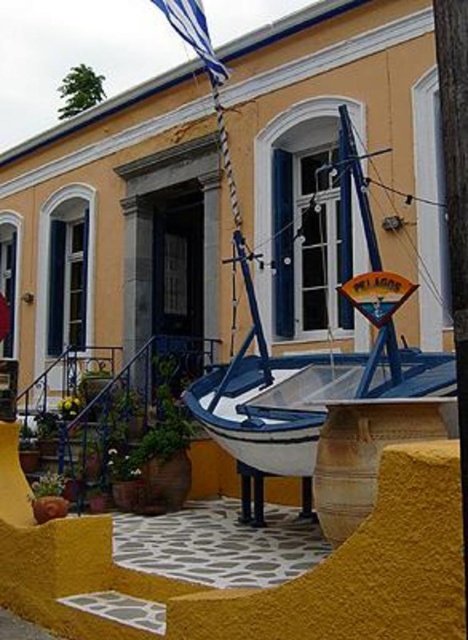
Question: From the image, what is the correct spatial relationship of blue painted wood boat at center in relation to blue fabric flag at upper center?

Choices:
 (A) right
 (B) left

Answer: (A)

Question: Which point appears closest to the camera in this image?

Choices:
 (A) (465, 429)
 (B) (417, 396)

Answer: (A)

Question: Is smooth wooden pole at center above blue fabric flag at upper center?

Choices:
 (A) yes
 (B) no

Answer: (B)

Question: Which point is closer to the camera?

Choices:
 (A) (213, 76)
 (B) (256, 433)

Answer: (B)

Question: Which object is closer to the camera taking this photo?

Choices:
 (A) smooth wooden pole at center
 (B) blue fabric flag at upper center

Answer: (A)

Question: Is blue painted wood boat at center thinner than blue fabric flag at upper center?

Choices:
 (A) yes
 (B) no

Answer: (A)